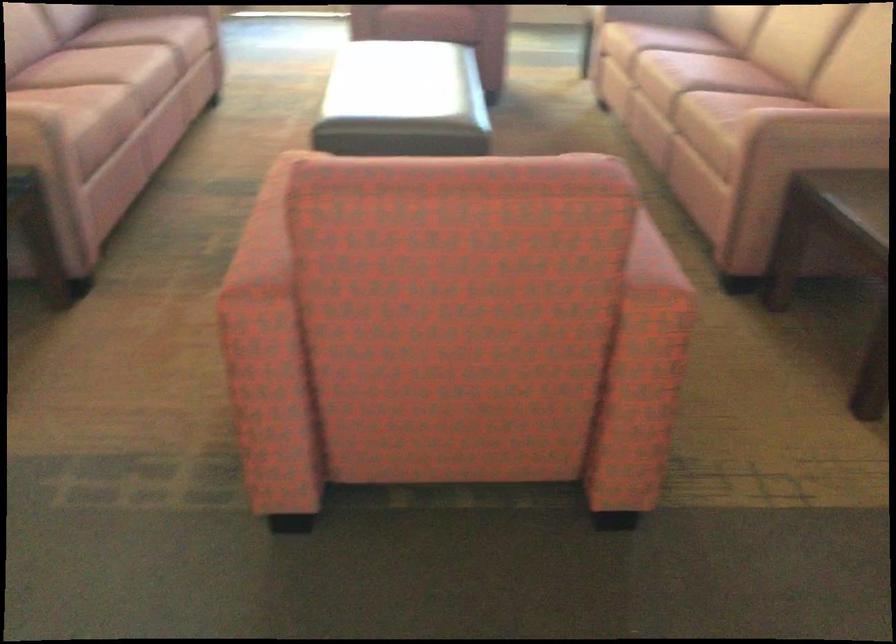
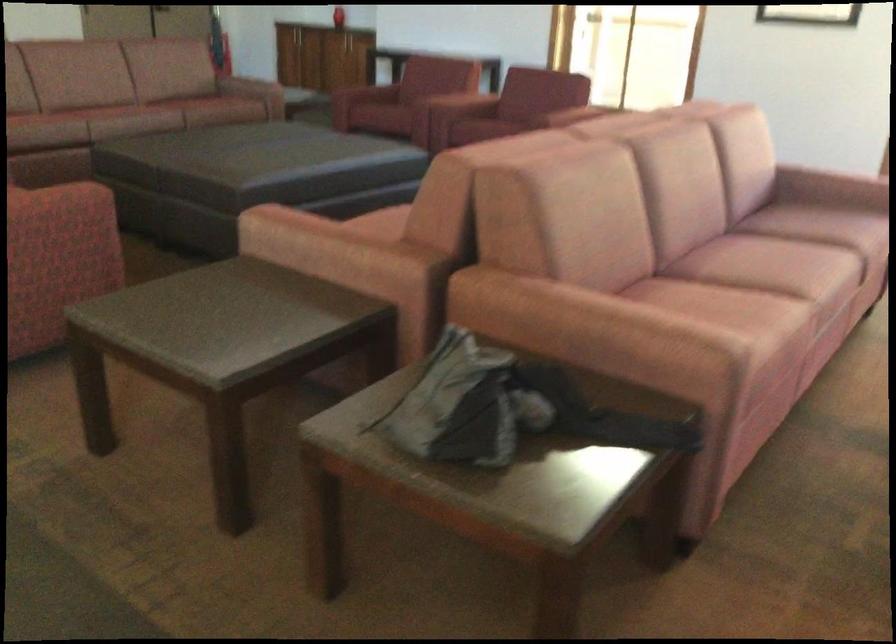
Question: The first image is from the beginning of the video and the second image is from the end. How did the camera likely rotate when shooting the video?

Choices:
 (A) Left
 (B) Right
 (C) Up
 (D) Down

Answer: (A)